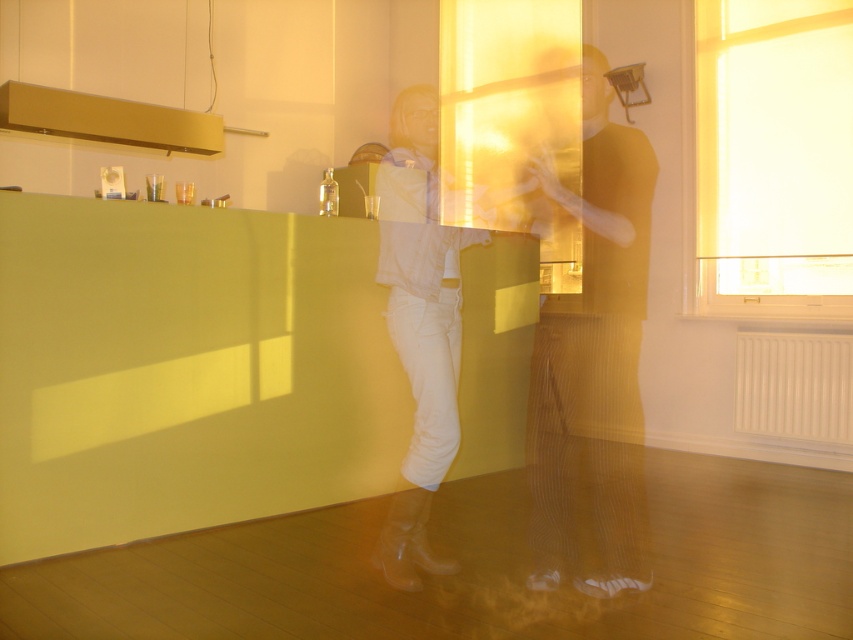
You are standing in the kitchen and see the matte gold tank top at center and the white leather boots at center. Which object is positioned more to the right?

The matte gold tank top at center is positioned to the right of the white leather boots at center.

You are designing a layout for a clothing store display. You have to place the matte gold tank top at center and the white leather boots at center on a mannequin. Which item should you place first to ensure proper fitting on the mannequin?

The matte gold tank top at center should be placed first because its width is larger than the white leather boots at center, allowing it to be positioned properly before the boots.